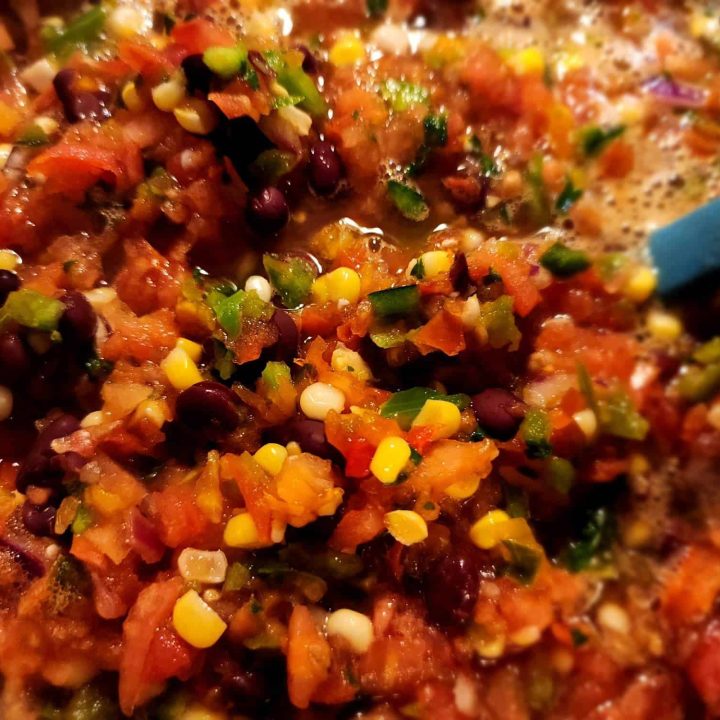
Locate an element on the screen. corner is located at coordinates click(x=612, y=656).